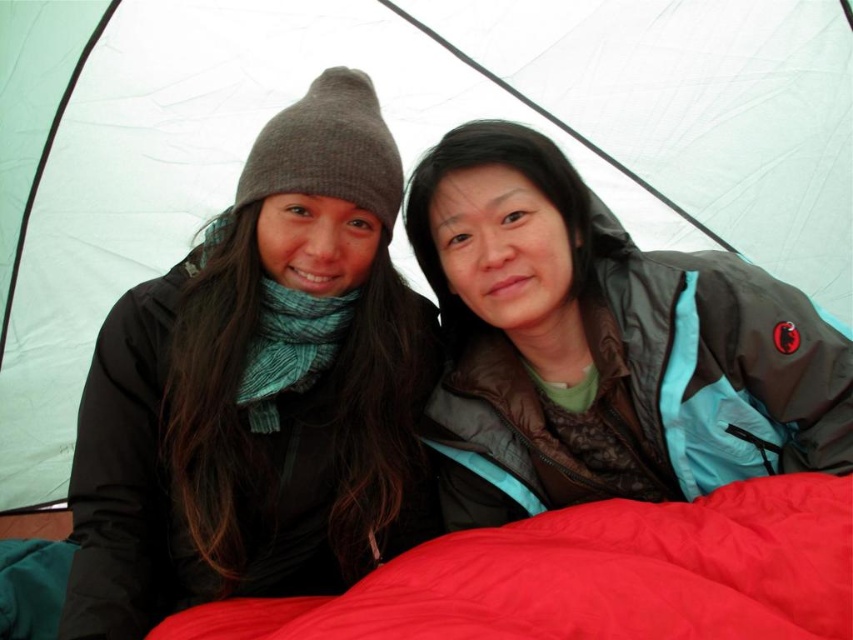
Is matte black jacket at left to the right of red soft fabric blanket at lower center from the viewer's perspective?

In fact, matte black jacket at left is to the left of red soft fabric blanket at lower center.

Between point (289, 531) and point (602, 544), which one is positioned in front?

Positioned in front is point (602, 544).

This screenshot has width=853, height=640. Identify the location of matte black jacket at left. (260, 388).

Is matte black jacket at left bigger than matte blue jacket at center?

No.

Who is more forward, (x=352, y=419) or (x=828, y=404)?

Positioned in front is point (x=828, y=404).

I want to click on matte black jacket at left, so click(260, 388).

Locate an element on the screen. matte black jacket at left is located at coordinates pyautogui.click(x=260, y=388).

Does matte blue jacket at center have a lesser height compared to red soft fabric blanket at lower center?

In fact, matte blue jacket at center may be taller than red soft fabric blanket at lower center.

Which is in front, point (622, 296) or point (566, 605)?

Point (566, 605) is more forward.

This screenshot has height=640, width=853. Identify the location of matte blue jacket at center. (602, 346).